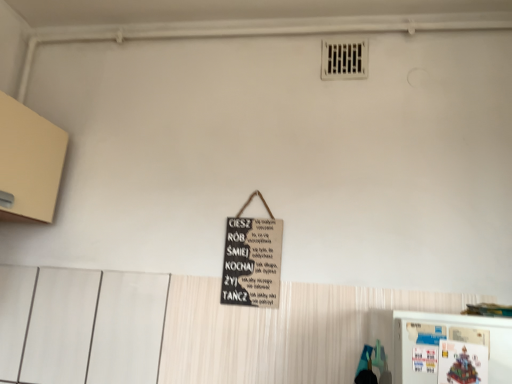
This screenshot has width=512, height=384. What do you see at coordinates (252, 262) in the screenshot?
I see `black chalkboard sign at center` at bounding box center [252, 262].

Locate an element on the screen. This screenshot has width=512, height=384. black chalkboard sign at center is located at coordinates (252, 262).

The height and width of the screenshot is (384, 512). In order to click on black chalkboard sign at center in this screenshot , I will do `click(252, 262)`.